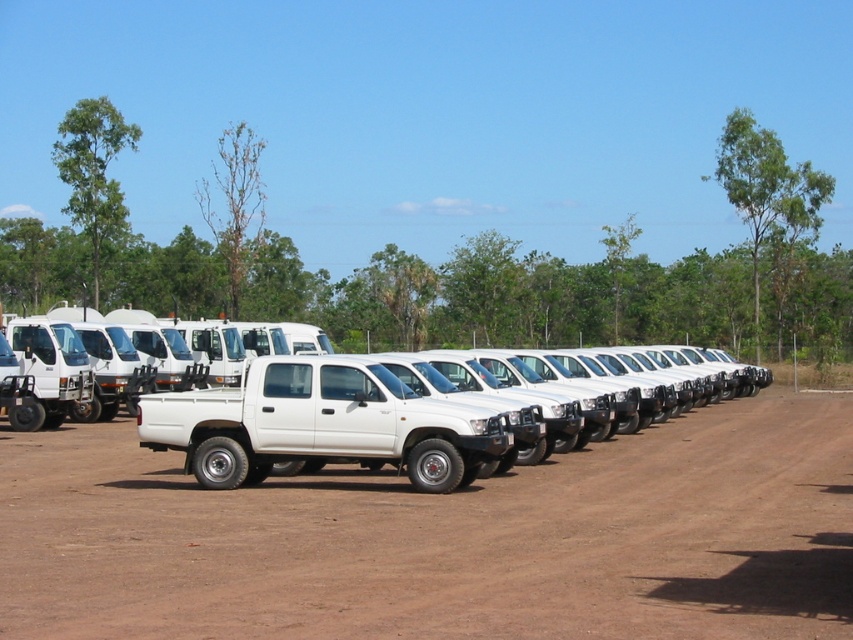
Question: Can you confirm if brown dirt field at center is positioned above white matte pickup truck at center?

Choices:
 (A) no
 (B) yes

Answer: (A)

Question: In this image, where is brown dirt field at center located relative to white matte pickup truck at center?

Choices:
 (A) left
 (B) right

Answer: (B)

Question: Which point is farther from the camera taking this photo?

Choices:
 (A) (334, 428)
 (B) (457, 525)

Answer: (A)

Question: Which object is farther from the camera taking this photo?

Choices:
 (A) brown dirt field at center
 (B) white matte pickup truck at center

Answer: (B)

Question: Does brown dirt field at center lie behind white matte pickup truck at center?

Choices:
 (A) yes
 (B) no

Answer: (B)